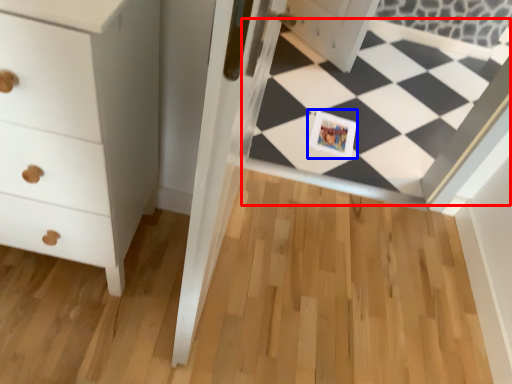
Question: Which object appears farthest to the camera in this image, square (highlighted by a red box) or postcard (highlighted by a blue box)?

Choices:
 (A) square
 (B) postcard

Answer: (B)